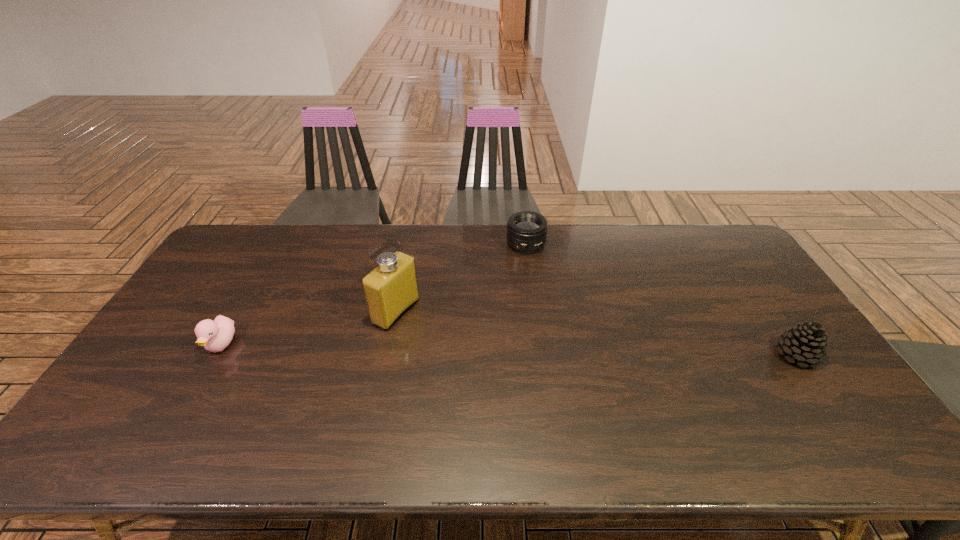
Where is `free space on the desktop that is between the duckling and the pinecone and is positioned on the front-facing side of the tallest object`? This screenshot has width=960, height=540. free space on the desktop that is between the duckling and the pinecone and is positioned on the front-facing side of the tallest object is located at coordinates (474, 349).

Where is `vacant space on the desktop that is between the leftmost object and the pinecone and is positioned on the side of the farthest object with brand markings and control switches`? The image size is (960, 540). vacant space on the desktop that is between the leftmost object and the pinecone and is positioned on the side of the farthest object with brand markings and control switches is located at coordinates (527, 350).